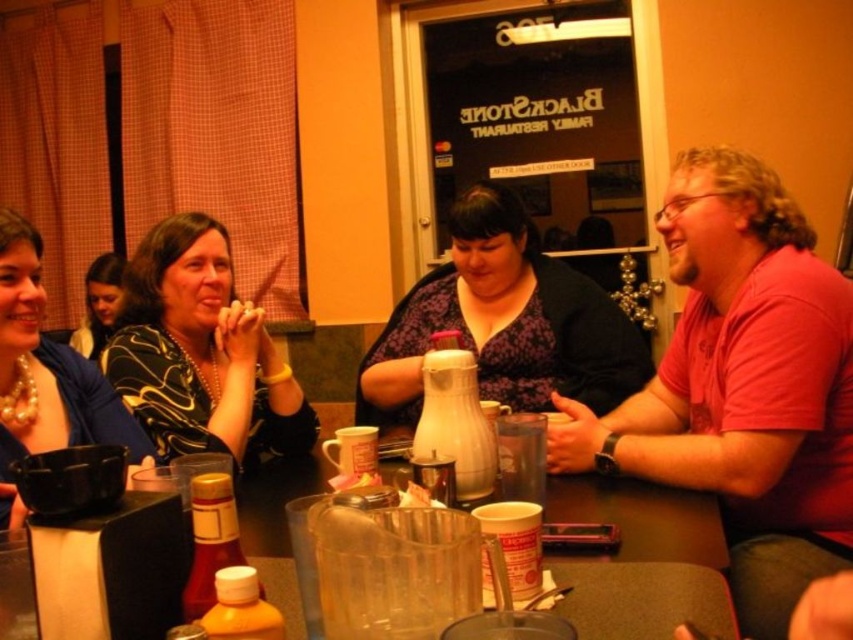
You are a fashion designer observing the image. You need to determine which item is taller between the black matte dress at center and the matte black shirt at upper left. Can you identify which one is taller?

The black matte dress at center has a greater height compared to the matte black shirt at upper left, so the black matte dress at center is taller.

You are a server at the restaurant and need to place a new order of drinks on the table. The pearl necklace at left and the white matte pitcher at center are already there. Which item should you avoid placing drinks near to prevent spills from damaging it?

You should avoid placing drinks near the pearl necklace at left because it is larger than the white matte pitcher at center and might be more prone to damage from spills.